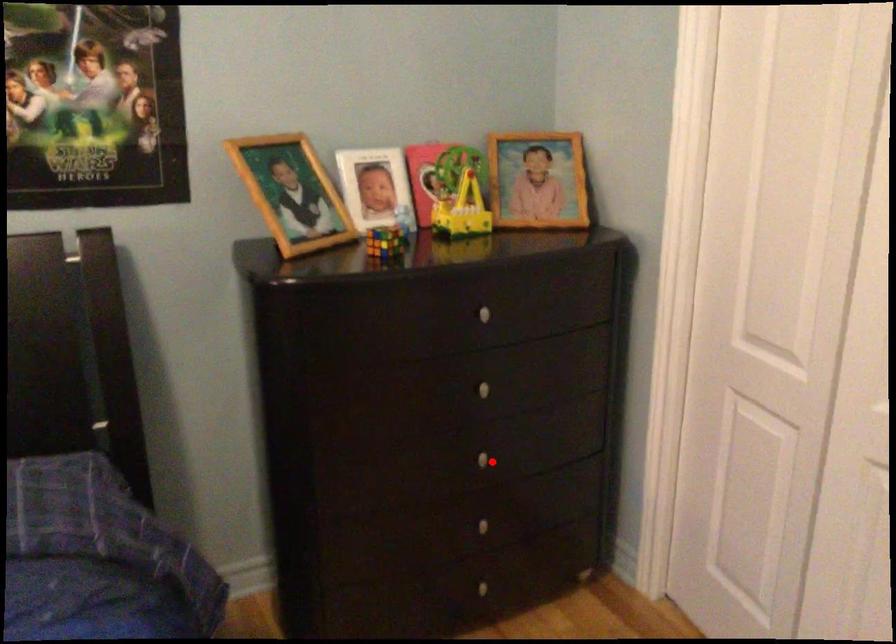
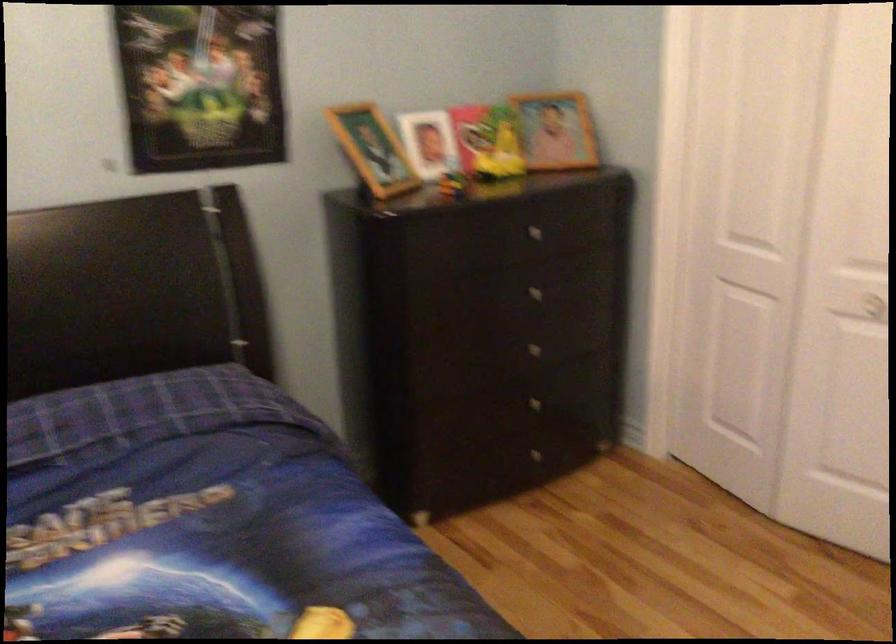
Question: I am providing you with two images of the same scene from different viewpoints. Given a red point in image1, look at the same physical point in image2. Is it:

Choices:
 (A) Closer to the viewpoint
 (B) Farther from the viewpoint

Answer: (B)